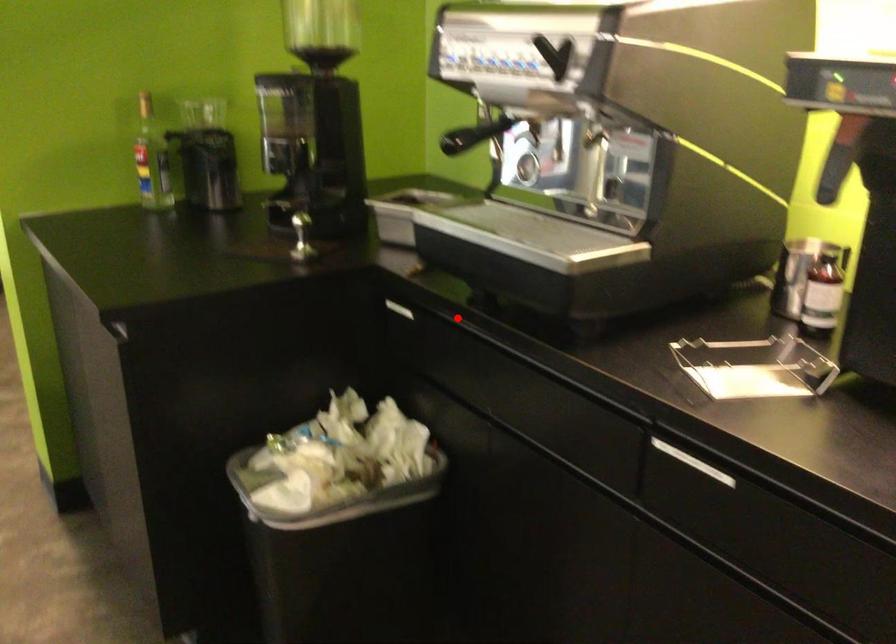
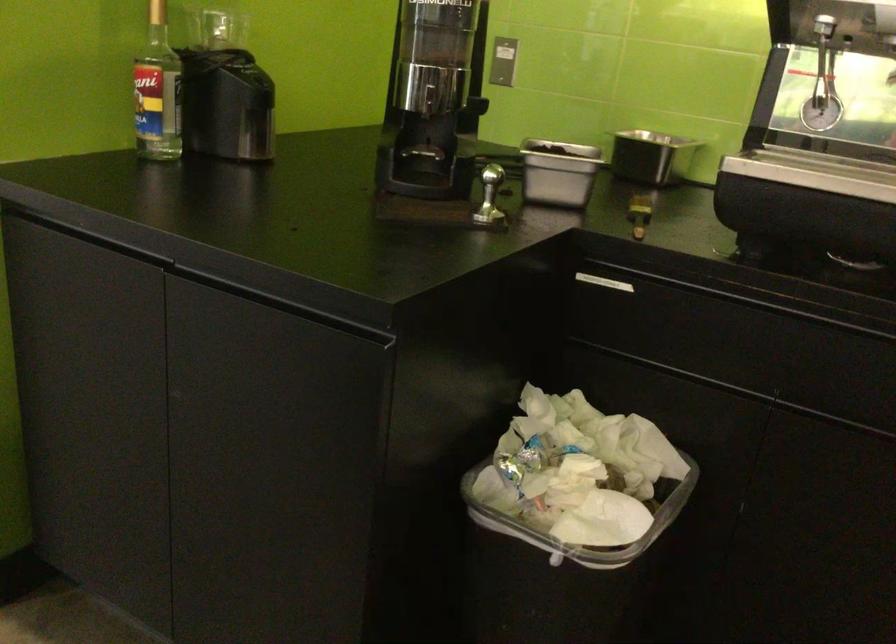
Where in the second image is the point corresponding to the highlighted location from the first image?

(744, 287)